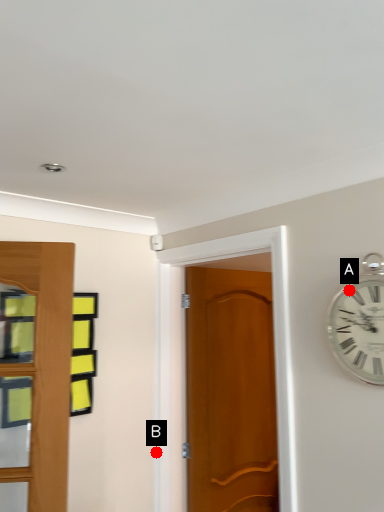
Question: Two points are circled on the image, labeled by A and B beside each circle. Which of the following is the farthest from the observer?

Choices:
 (A) A is further
 (B) B is further

Answer: (B)